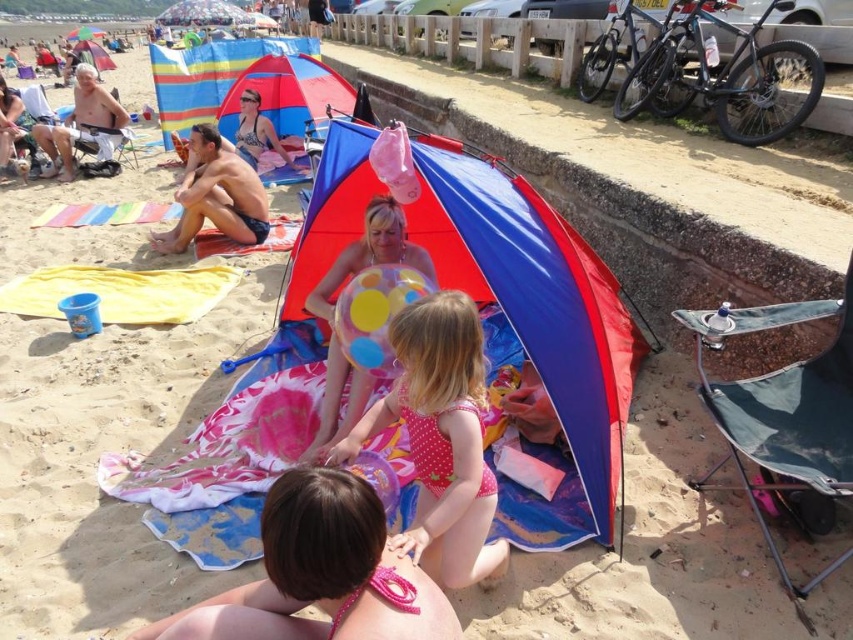
You are a photographer trying to capture a photo of the pink fabric bikini at lower center and the shiny silver helmet at upper left. From your current position, which object is located to the right of the other?

The pink fabric bikini at lower center is positioned on the right side of shiny silver helmet at upper left.

You are standing on the beach and want to give the tan skin man at center a 10 foot long surfboard. Can you hand it to him without moving from your current position?

The distance between you and the tan skin man at center is 17.60 feet, which is greater than the 10 foot length of the surfboard. Therefore, you cannot hand him the surfboard without moving closer.

What is located at the coordinates point (x=216, y=195) in the beach scene?

The tan skin man at center is located at point (x=216, y=195).